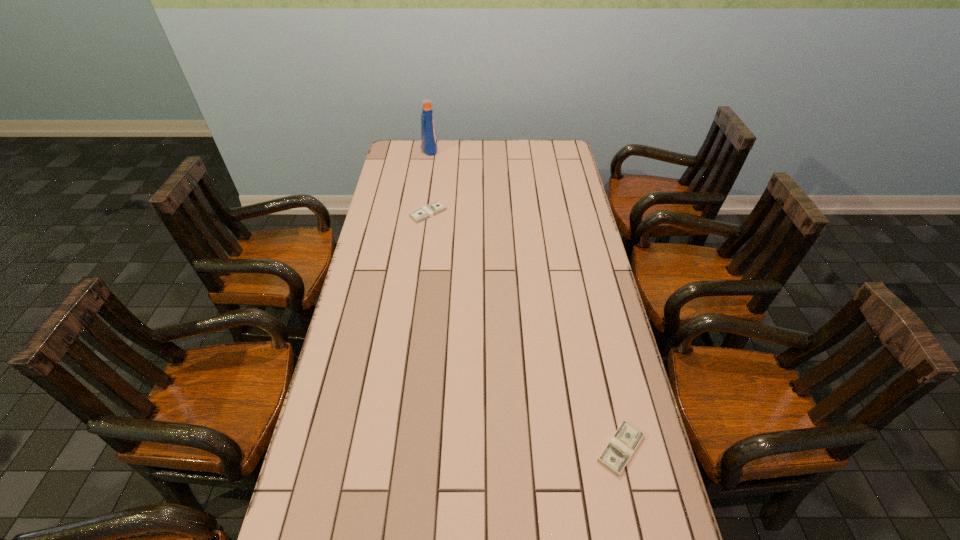
Select which object appears as the closest to the rightmost object. Please provide its 2D coordinates. Your answer should be formatted as a tuple, i.e. [(x, y)], where the tuple contains the x and y coordinates of a point satisfying the conditions above.

[(432, 209)]

Identify the location of free location that satisfies the following two spatial constraints: 1. on the label of the farthest object; 2. on the right side of the right dollar. The width and height of the screenshot is (960, 540). (384, 448).

The image size is (960, 540). I want to click on free space that satisfies the following two spatial constraints: 1. on the label of the farthest object; 2. on the left side of the nearest object, so click(384, 448).

At what (x,y) coordinates should I click in order to perform the action: click on free space that satisfies the following two spatial constraints: 1. on the back side of the farther dollar; 2. on the label of the detergent. Please return your answer as a coordinate pair (x, y). Image resolution: width=960 pixels, height=540 pixels. Looking at the image, I should click on (437, 148).

Find the location of a particular element. vacant space that satisfies the following two spatial constraints: 1. on the label of the nearest object; 2. on the right side of the tallest object is located at coordinates (384, 448).

Locate an element on the screen. The width and height of the screenshot is (960, 540). blank space that satisfies the following two spatial constraints: 1. on the back side of the nearest object; 2. on the label of the farthest object is located at coordinates (554, 148).

Identify the location of vacant area that satisfies the following two spatial constraints: 1. on the front side of the nearer dollar; 2. on the left side of the farther dollar. This screenshot has height=540, width=960. (396, 448).

Locate an element on the screen. Image resolution: width=960 pixels, height=540 pixels. free space that satisfies the following two spatial constraints: 1. on the back side of the second farthest object; 2. on the label of the farthest object is located at coordinates (437, 148).

What are the coordinates of `vacant space that satisfies the following two spatial constraints: 1. on the label of the detergent; 2. on the right side of the left dollar` in the screenshot? It's located at (420, 213).

At what (x,y) coordinates should I click in order to perform the action: click on vacant region that satisfies the following two spatial constraints: 1. on the label of the nearest object; 2. on the right side of the farthest object. Please return your answer as a coordinate pair (x, y). The width and height of the screenshot is (960, 540). Looking at the image, I should click on (384, 448).